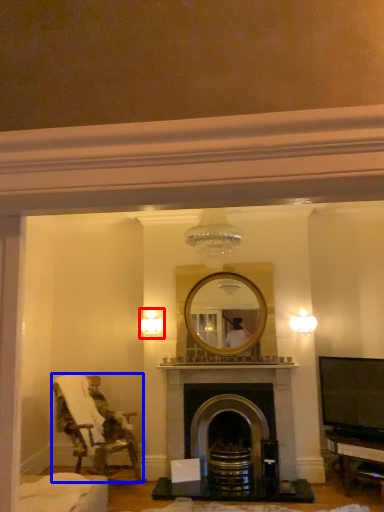
Question: Which point is further to the camera, light fixture (highlighted by a red box) or chair (highlighted by a blue box)?

Choices:
 (A) light fixture
 (B) chair

Answer: (A)